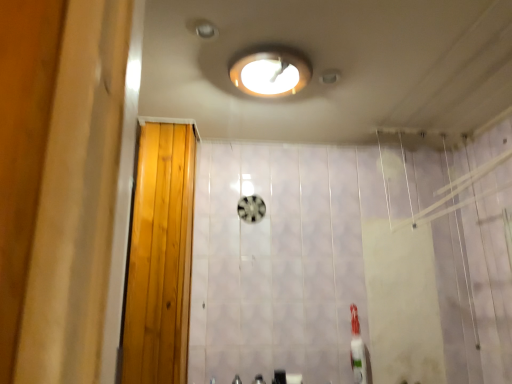
Describe the element at coordinates (160, 257) in the screenshot. This screenshot has height=384, width=512. I see `wooden door at left` at that location.

The width and height of the screenshot is (512, 384). Describe the element at coordinates (236, 380) in the screenshot. I see `metallic silver faucet at lower center, the 1th faucet positioned from the left` at that location.

Measure the distance between metallic silver faucet at lower center, the 1th faucet positioned from the left, and camera.

6.17 feet.

Locate an element on the screen. white matte toilet paper at lower center is located at coordinates pos(294,378).

Does metallic silver faucet at lower center, the 2th faucet when ordered from right to left, touch white matte toilet paper at lower center?

No, metallic silver faucet at lower center, the 2th faucet when ordered from right to left, is not making contact with white matte toilet paper at lower center.

Would you say metallic silver faucet at lower center, the 1th faucet positioned from the left, is to the left or to the right of white matte toilet paper at lower center in the picture?

From the image, it's evident that metallic silver faucet at lower center, the 1th faucet positioned from the left, is to the left of white matte toilet paper at lower center.

In the scene shown: How many degrees apart are the facing directions of metallic silver faucet at lower center, the 2th faucet when ordered from right to left, and white matte toilet paper at lower center?

The angular difference between metallic silver faucet at lower center, the 2th faucet when ordered from right to left, and white matte toilet paper at lower center is 2.71 degrees.

Is metallic silver faucet at lower center, the 2th faucet when ordered from right to left, oriented away from white matte toilet paper at lower center?

No.

Is point (290, 383) closer to camera compared to point (256, 375)?

Yes, it is.

Measure the distance between white matte toilet paper at lower center and satin nickel faucet at lower center, the first faucet viewed from the right.

white matte toilet paper at lower center and satin nickel faucet at lower center, the first faucet viewed from the right, are 5.18 inches apart.

Would you say satin nickel faucet at lower center, the first faucet viewed from the right, is part of white matte toilet paper at lower center's contents?

Actually, satin nickel faucet at lower center, the first faucet viewed from the right, is outside white matte toilet paper at lower center.

Consider the image. From a real-world perspective, relative to satin nickel faucet at lower center, which is the second faucet from left to right, is white matte toilet paper at lower center vertically above or below?

In terms of real-world spatial position, white matte toilet paper at lower center is below satin nickel faucet at lower center, which is the second faucet from left to right.

Does matte white light fixture at upper center contain satin nickel faucet at lower center, the first faucet viewed from the right?

No.

Can you confirm if matte white light fixture at upper center is bigger than satin nickel faucet at lower center, the first faucet viewed from the right?

Correct, matte white light fixture at upper center is larger in size than satin nickel faucet at lower center, the first faucet viewed from the right.

Which is in front, point (308, 62) or point (252, 382)?

The point (308, 62) is closer.

From the image's perspective, is white glossy toothbrush at lower right above wooden door at left?

No, from the image's perspective, white glossy toothbrush at lower right is not above wooden door at left.

Is white glossy toothbrush at lower right bigger than wooden door at left?

No, white glossy toothbrush at lower right is not bigger than wooden door at left.

Would you consider white glossy toothbrush at lower right to be distant from wooden door at left?

No.

Which of these two, wooden door at left or white matte toilet paper at lower center, stands taller?

With more height is wooden door at left.

In the scene shown: Which point is more forward, (174, 182) or (292, 374)?

Positioned in front is point (174, 182).

Which is in front, wooden door at left or white matte toilet paper at lower center?

wooden door at left is closer to the camera.

Does wooden door at left have a smaller size compared to white matte toilet paper at lower center?

Incorrect, wooden door at left is not smaller in size than white matte toilet paper at lower center.

Would you consider white glossy toothbrush at lower right to be distant from matte white light fixture at upper center?

Yes, white glossy toothbrush at lower right and matte white light fixture at upper center are quite far apart.

Considering the sizes of objects white glossy toothbrush at lower right and matte white light fixture at upper center in the image provided, who is bigger, white glossy toothbrush at lower right or matte white light fixture at upper center?

matte white light fixture at upper center.

Between white glossy toothbrush at lower right and matte white light fixture at upper center, which one is positioned behind?

white glossy toothbrush at lower right is more distant.

How much distance is there between white glossy toothbrush at lower right and matte white light fixture at upper center?

1.18 meters.

From the picture: Is satin nickel faucet at lower center, the first faucet viewed from the right, smaller than wooden door at left?

Yes, satin nickel faucet at lower center, the first faucet viewed from the right, is smaller than wooden door at left.

Does satin nickel faucet at lower center, which is the second faucet from left to right, turn towards wooden door at left?

No, satin nickel faucet at lower center, which is the second faucet from left to right, is not oriented towards wooden door at left.

Can you tell me how much satin nickel faucet at lower center, which is the second faucet from left to right, and wooden door at left differ in facing direction?

The facing directions of satin nickel faucet at lower center, which is the second faucet from left to right, and wooden door at left are 1.61 degrees apart.

Based on the photo, is the depth of satin nickel faucet at lower center, the first faucet viewed from the right, less than that of wooden door at left?

No, satin nickel faucet at lower center, the first faucet viewed from the right, is behind wooden door at left.

From a real-world perspective, which faucet is the 1st one above the white matte toilet paper at lower center? Please provide its 2D coordinates.

[(236, 380)]

Image resolution: width=512 pixels, height=384 pixels. Identify the location of the 2nd faucet above when counting from the white matte toilet paper at lower center (from the image's perspective). (258, 379).

Estimate the real-world distances between objects in this image. Which object is closer to matte white light fixture at upper center, wooden door at left or metallic silver faucet at lower center, the 1th faucet positioned from the left?

wooden door at left is closer to matte white light fixture at upper center.

Based on their spatial positions, is wooden door at left or satin nickel faucet at lower center, which is the second faucet from left to right, further from matte white light fixture at upper center?

satin nickel faucet at lower center, which is the second faucet from left to right, is positioned further to the anchor matte white light fixture at upper center.

From the image, which object appears to be nearer to white matte toilet paper at lower center, white glossy toothbrush at lower right or matte white light fixture at upper center?

white glossy toothbrush at lower right is closer to white matte toilet paper at lower center.

From the image, which object appears to be nearer to metallic silver faucet at lower center, the 1th faucet positioned from the left, wooden door at left or satin nickel faucet at lower center, which is the second faucet from left to right?

satin nickel faucet at lower center, which is the second faucet from left to right, is closer to metallic silver faucet at lower center, the 1th faucet positioned from the left.

From the image, which object appears to be nearer to white glossy toothbrush at lower right, metallic silver faucet at lower center, the 1th faucet positioned from the left, or matte white light fixture at upper center?

The object closer to white glossy toothbrush at lower right is metallic silver faucet at lower center, the 1th faucet positioned from the left.

Based on their spatial positions, is satin nickel faucet at lower center, the first faucet viewed from the right, or matte white light fixture at upper center further from white glossy toothbrush at lower right?

Among the two, matte white light fixture at upper center is located further to white glossy toothbrush at lower right.

Based on their spatial positions, is metallic silver faucet at lower center, the 2th faucet when ordered from right to left, or matte white light fixture at upper center further from satin nickel faucet at lower center, which is the second faucet from left to right?

The object further to satin nickel faucet at lower center, which is the second faucet from left to right, is matte white light fixture at upper center.

From the image, which object appears to be nearer to wooden door at left, matte white light fixture at upper center or satin nickel faucet at lower center, which is the second faucet from left to right?

Among the two, matte white light fixture at upper center is located nearer to wooden door at left.

Image resolution: width=512 pixels, height=384 pixels. In order to click on toilet paper situated between metallic silver faucet at lower center, the 1th faucet positioned from the left, and white glossy toothbrush at lower right from left to right in this screenshot , I will do `click(294, 378)`.

Where is `door between matte white light fixture at upper center and metallic silver faucet at lower center, the 1th faucet positioned from the left, from top to bottom`? The height and width of the screenshot is (384, 512). door between matte white light fixture at upper center and metallic silver faucet at lower center, the 1th faucet positioned from the left, from top to bottom is located at coordinates (160, 257).

Where is `toilet paper situated between wooden door at left and white glossy toothbrush at lower right from left to right`? toilet paper situated between wooden door at left and white glossy toothbrush at lower right from left to right is located at coordinates (294, 378).

In order to click on toothbrush between matte white light fixture at upper center and white matte toilet paper at lower center vertically in this screenshot , I will do `click(357, 349)`.